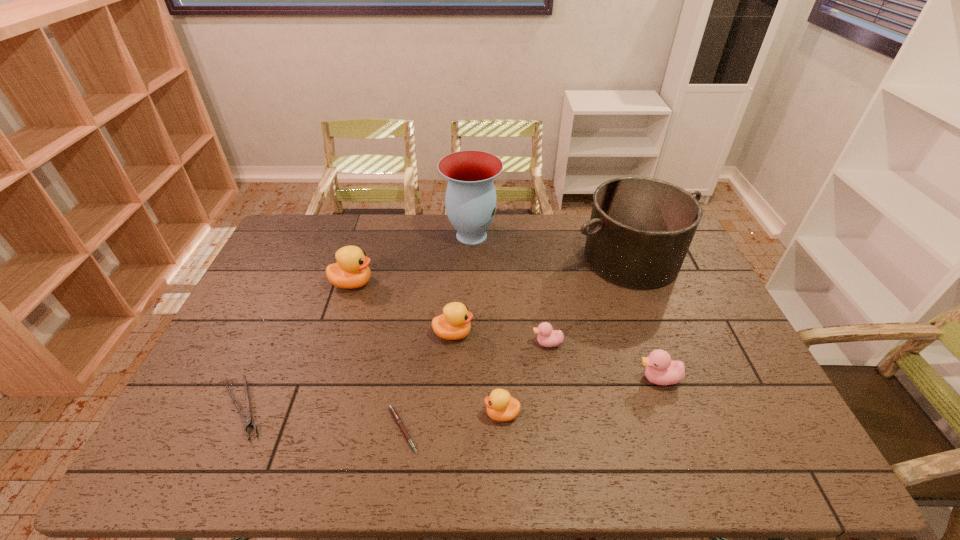
Where is `vacant region located 0.310m on the back of the tongs`? vacant region located 0.310m on the back of the tongs is located at coordinates (293, 298).

Find the location of a particular element. The height and width of the screenshot is (540, 960). vacant point located 0.150m at the nib of the pink pen is located at coordinates (481, 429).

The image size is (960, 540). I want to click on vase located at the far edge, so click(471, 202).

Locate an element on the screen. Image resolution: width=960 pixels, height=540 pixels. pan positioned at the far edge is located at coordinates pos(640,230).

Find the location of a particular element. tongs present at the near edge is located at coordinates (248, 422).

In order to click on pen at the near edge in this screenshot , I will do `click(392, 409)`.

Identify the location of object present at the left edge. This screenshot has width=960, height=540. (248, 422).

You are a GUI agent. You are given a task and a screenshot of the screen. Output one action in this format:
    pyautogui.click(x=<x>, y=<y>)
    Task: Click on the object that is at the right edge
    This screenshot has height=540, width=960.
    Given the screenshot: What is the action you would take?
    pyautogui.click(x=640, y=230)

This screenshot has width=960, height=540. What are the coordinates of `object that is at the near left corner` in the screenshot? It's located at (248, 422).

You are a GUI agent. You are given a task and a screenshot of the screen. Output one action in this format:
    pyautogui.click(x=<x>, y=<y>)
    Task: Click on the object that is positioned at the far right corner
    The height and width of the screenshot is (540, 960).
    Given the screenshot: What is the action you would take?
    pyautogui.click(x=640, y=230)